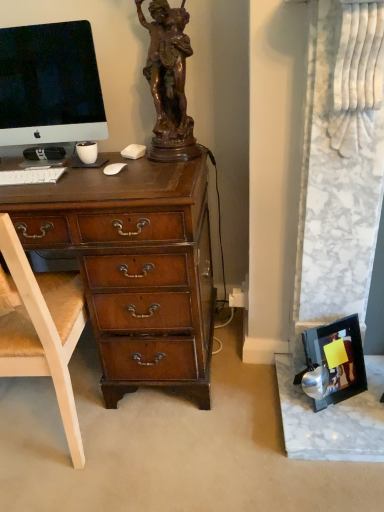
Question: From the image's perspective, is metallic silver picture frame at lower right over white matte keyboard at left?

Choices:
 (A) no
 (B) yes

Answer: (A)

Question: Considering the relative sizes of metallic silver picture frame at lower right and white matte keyboard at left in the image provided, is metallic silver picture frame at lower right thinner than white matte keyboard at left?

Choices:
 (A) yes
 (B) no

Answer: (B)

Question: From a real-world perspective, is metallic silver picture frame at lower right on white matte keyboard at left?

Choices:
 (A) yes
 (B) no

Answer: (B)

Question: Can you confirm if metallic silver picture frame at lower right is wider than white matte keyboard at left?

Choices:
 (A) yes
 (B) no

Answer: (A)

Question: Is metallic silver picture frame at lower right taller than white matte keyboard at left?

Choices:
 (A) yes
 (B) no

Answer: (A)

Question: Is metallic silver picture frame at lower right far from white matte keyboard at left?

Choices:
 (A) yes
 (B) no

Answer: (A)

Question: Considering the relative sizes of white wood chair at left and metallic silver picture frame at lower right in the image provided, is white wood chair at left bigger than metallic silver picture frame at lower right?

Choices:
 (A) yes
 (B) no

Answer: (A)

Question: Is white wood chair at left smaller than metallic silver picture frame at lower right?

Choices:
 (A) no
 (B) yes

Answer: (A)

Question: Is white wood chair at left thinner than metallic silver picture frame at lower right?

Choices:
 (A) no
 (B) yes

Answer: (A)

Question: Is white wood chair at left to the right of metallic silver picture frame at lower right from the viewer's perspective?

Choices:
 (A) no
 (B) yes

Answer: (A)

Question: Is white wood chair at left facing away from metallic silver picture frame at lower right?

Choices:
 (A) no
 (B) yes

Answer: (A)

Question: From a real-world perspective, is white wood chair at left under metallic silver picture frame at lower right?

Choices:
 (A) no
 (B) yes

Answer: (A)

Question: Considering the relative sizes of satin black monitor at upper left and white wood chair at left in the image provided, is satin black monitor at upper left taller than white wood chair at left?

Choices:
 (A) no
 (B) yes

Answer: (A)